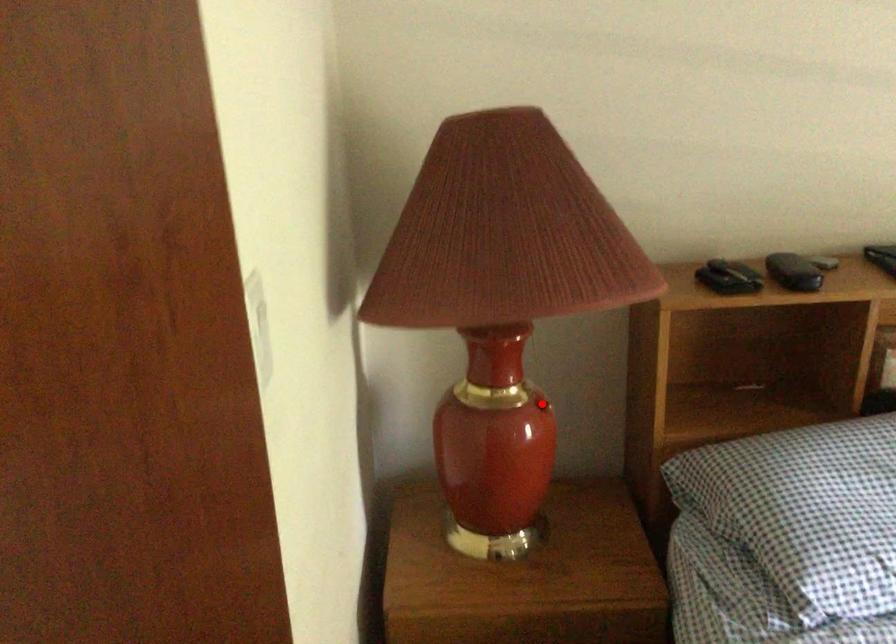
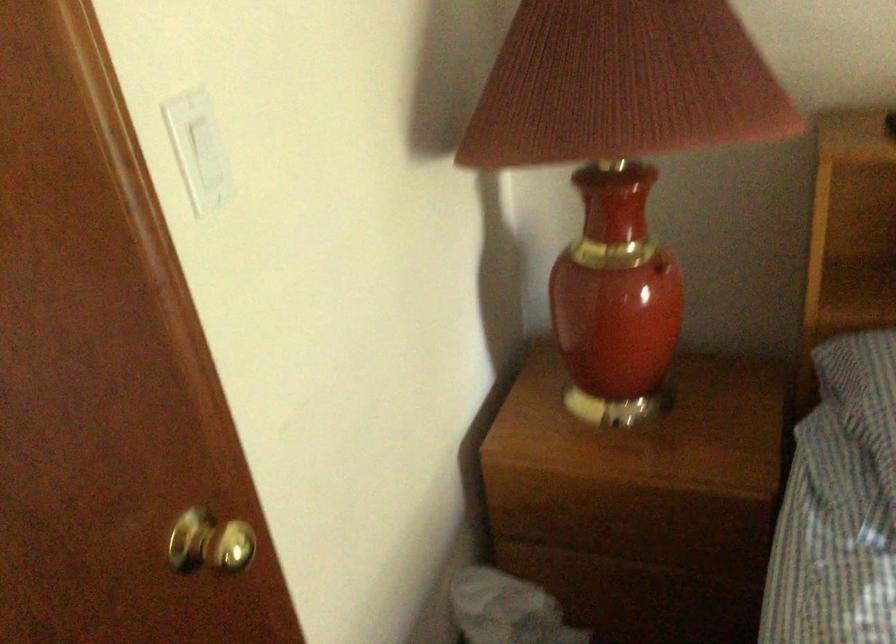
The point at the highlighted location is marked in the first image. Where is the corresponding point in the second image?

(661, 267)